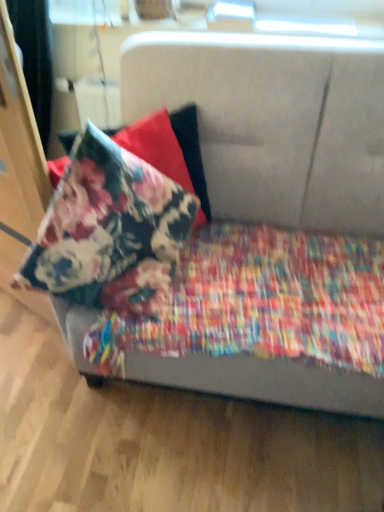
Question: Does floral fabric pillow at upper left have a lesser width compared to textured fabric couch at center?

Choices:
 (A) no
 (B) yes

Answer: (B)

Question: Is floral fabric pillow at upper left outside of textured fabric couch at center?

Choices:
 (A) no
 (B) yes

Answer: (A)

Question: Is textured fabric couch at center a part of floral fabric pillow at upper left?

Choices:
 (A) no
 (B) yes

Answer: (A)

Question: Would you say floral fabric pillow at upper left is a long distance from textured fabric couch at center?

Choices:
 (A) yes
 (B) no

Answer: (B)

Question: Is floral fabric pillow at upper left at the right side of textured fabric couch at center?

Choices:
 (A) no
 (B) yes

Answer: (A)

Question: Does floral fabric pillow at upper left come in front of textured fabric couch at center?

Choices:
 (A) no
 (B) yes

Answer: (A)

Question: Could you tell me if floral cotton blanket at lower left is facing floral fabric pillow at upper left?

Choices:
 (A) no
 (B) yes

Answer: (A)

Question: Does floral cotton blanket at lower left appear on the left side of floral fabric pillow at upper left?

Choices:
 (A) no
 (B) yes

Answer: (A)

Question: From a real-world perspective, is floral cotton blanket at lower left beneath floral fabric pillow at upper left?

Choices:
 (A) yes
 (B) no

Answer: (A)

Question: Does floral cotton blanket at lower left appear on the right side of floral fabric pillow at upper left?

Choices:
 (A) yes
 (B) no

Answer: (A)

Question: Considering the relative sizes of floral cotton blanket at lower left and floral fabric pillow at upper left in the image provided, is floral cotton blanket at lower left bigger than floral fabric pillow at upper left?

Choices:
 (A) yes
 (B) no

Answer: (A)

Question: Considering the relative sizes of floral cotton blanket at lower left and floral fabric pillow at upper left in the image provided, is floral cotton blanket at lower left smaller than floral fabric pillow at upper left?

Choices:
 (A) no
 (B) yes

Answer: (A)

Question: Considering the relative sizes of textured fabric couch at center and floral fabric pillow at upper left in the image provided, is textured fabric couch at center thinner than floral fabric pillow at upper left?

Choices:
 (A) no
 (B) yes

Answer: (A)